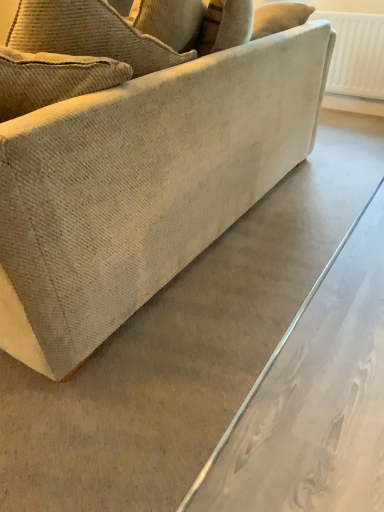
Question: Are beige fabric couch at center and white textured radiator at upper right making contact?

Choices:
 (A) yes
 (B) no

Answer: (B)

Question: Is beige fabric couch at center at the left side of white textured radiator at upper right?

Choices:
 (A) yes
 (B) no

Answer: (A)

Question: Is beige fabric couch at center turned away from white textured radiator at upper right?

Choices:
 (A) no
 (B) yes

Answer: (A)

Question: Can you confirm if beige fabric couch at center is wider than white textured radiator at upper right?

Choices:
 (A) no
 (B) yes

Answer: (B)

Question: Can you confirm if beige fabric couch at center is thinner than white textured radiator at upper right?

Choices:
 (A) yes
 (B) no

Answer: (B)

Question: From the image's perspective, is beige fabric couch at center beneath white textured radiator at upper right?

Choices:
 (A) no
 (B) yes

Answer: (B)

Question: Does white textured radiator at upper right lie behind beige fabric couch at center?

Choices:
 (A) yes
 (B) no

Answer: (A)

Question: Can you confirm if white textured radiator at upper right is thinner than beige fabric couch at center?

Choices:
 (A) yes
 (B) no

Answer: (A)

Question: Is white textured radiator at upper right shorter than beige fabric couch at center?

Choices:
 (A) yes
 (B) no

Answer: (A)

Question: Considering the relative sizes of white textured radiator at upper right and beige fabric couch at center in the image provided, is white textured radiator at upper right bigger than beige fabric couch at center?

Choices:
 (A) no
 (B) yes

Answer: (A)

Question: Is the surface of white textured radiator at upper right in direct contact with beige fabric couch at center?

Choices:
 (A) yes
 (B) no

Answer: (B)

Question: From a real-world perspective, is white textured radiator at upper right under beige fabric couch at center?

Choices:
 (A) no
 (B) yes

Answer: (B)

Question: From a real-world perspective, is beige fabric couch at center physically located above or below white textured radiator at upper right?

Choices:
 (A) below
 (B) above

Answer: (B)